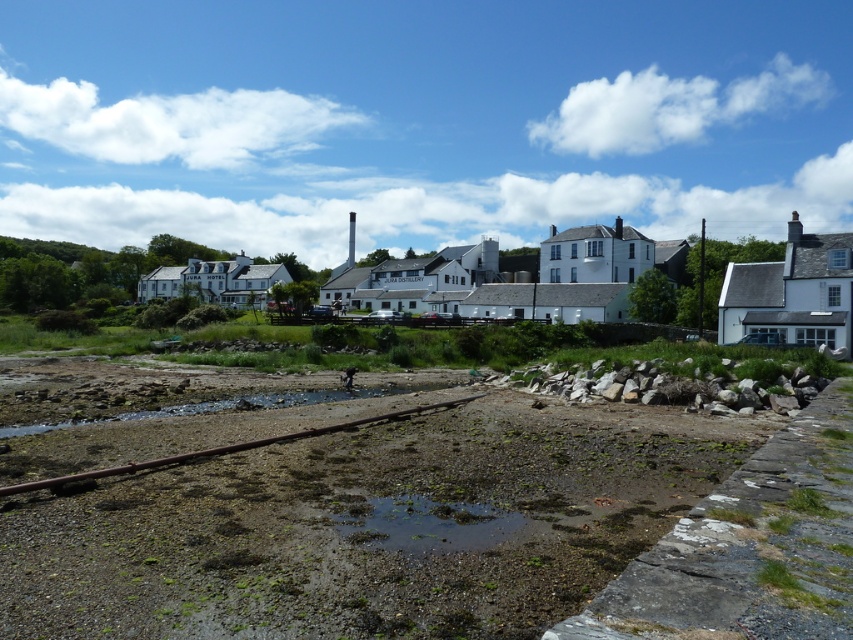
Looking at this image, you are a photographer planning to capture the white matte building at center and the green mossy water at center in a single frame. Based on the scene, which object should you position closer to the edge of your camera frame to ensure both are fully visible?

The white matte building at center is wider than the green mossy water at center. To ensure both are fully visible in the frame, position the wider white matte building at center closer to the edge of the camera frame so that there is enough space to accommodate its greater width.

You are a delivery person trying to navigate to the JURA DISTILLERY. You see the green mossy water at center and the rusty metal train track at lower center. Which path should you avoid to prevent your vehicle from getting stuck?

You should avoid the green mossy water at center because it is shorter than the rusty metal train track at lower center, meaning it might be shallower and less stable for vehicle passage.